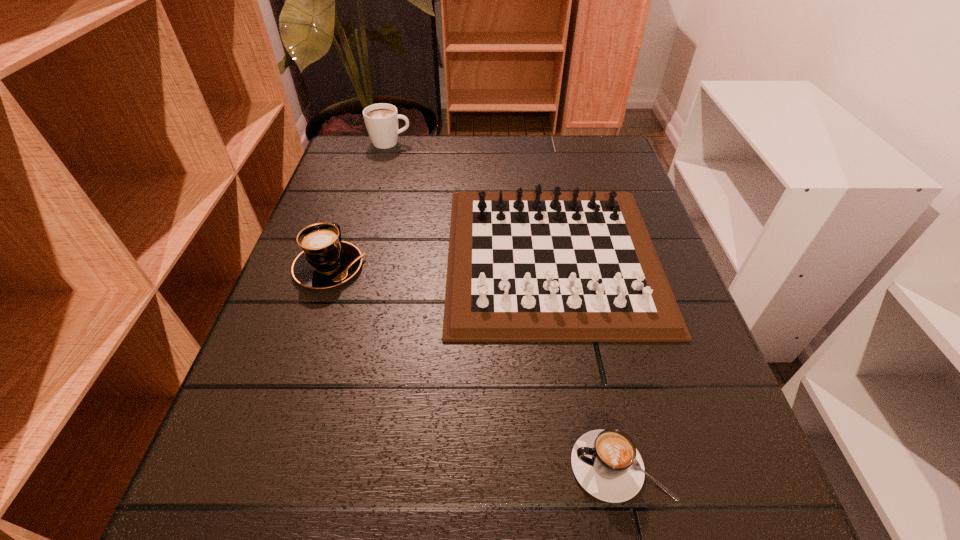
This screenshot has height=540, width=960. In order to click on free space at the right edge in this screenshot , I will do `click(568, 188)`.

Locate an element on the screen. The image size is (960, 540). free location at the far left corner is located at coordinates (347, 141).

At what (x,y) coordinates should I click in order to perform the action: click on free space at the far right corner of the desktop. Please return your answer as a coordinate pair (x, y). The image size is (960, 540). Looking at the image, I should click on (621, 159).

Where is `free point at the near right corner`? free point at the near right corner is located at coordinates (761, 523).

At what (x,y) coordinates should I click in order to perform the action: click on free area in between the shortest object and the second nearest cappuccino. Please return your answer as a coordinate pair (x, y). The width and height of the screenshot is (960, 540). Looking at the image, I should click on (475, 367).

At what (x,y) coordinates should I click in order to perform the action: click on unoccupied area between the shortest cappuccino and the second nearest cappuccino. Please return your answer as a coordinate pair (x, y). This screenshot has width=960, height=540. Looking at the image, I should click on (475, 367).

Locate an element on the screen. This screenshot has width=960, height=540. free space between the second farthest cappuccino and the farthest object is located at coordinates (360, 205).

Image resolution: width=960 pixels, height=540 pixels. In order to click on vacant space in between the gameboard and the second farthest cappuccino in this screenshot , I will do tap(441, 262).

In order to click on vacant area that lies between the gameboard and the second farthest cappuccino in this screenshot , I will do `click(441, 262)`.

At what (x,y) coordinates should I click in order to perform the action: click on vacant area that lies between the second farthest cappuccino and the farthest cappuccino. Please return your answer as a coordinate pair (x, y). The image size is (960, 540). Looking at the image, I should click on (360, 205).